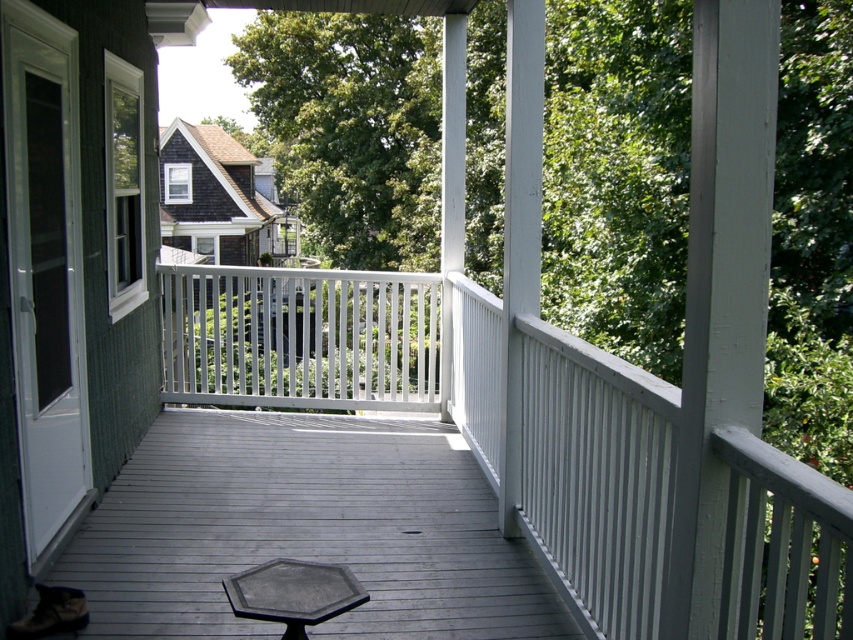
Question: Which object appears farthest from the camera in this image?

Choices:
 (A) white plastic chair at center
 (B) gray wood deck at center
 (C) white painted wood balustrade at center

Answer: (A)

Question: Is white painted wood balustrade at center to the right of white plastic chair at center from the viewer's perspective?

Choices:
 (A) yes
 (B) no

Answer: (A)

Question: Can you confirm if gray wood deck at center is bigger than white plastic chair at center?

Choices:
 (A) yes
 (B) no

Answer: (B)

Question: Does gray wood deck at center appear under white painted wood balustrade at center?

Choices:
 (A) yes
 (B) no

Answer: (A)

Question: Among these points, which one is nearest to the camera?

Choices:
 (A) (239, 362)
 (B) (242, 444)
 (C) (271, 280)

Answer: (B)

Question: Which object is positioned closest to the gray wood deck at center?

Choices:
 (A) white painted wood balustrade at center
 (B) white plastic chair at center

Answer: (A)